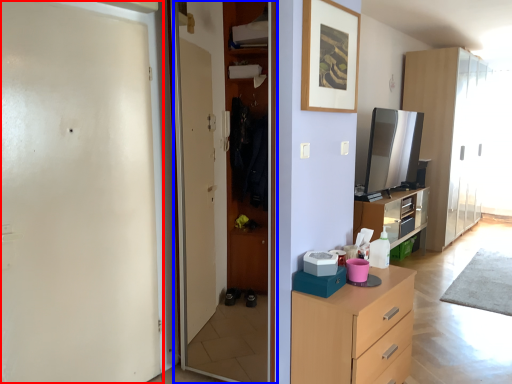
Question: Among these objects, which one is farthest to the camera, screen door (highlighted by a red box) or screen door (highlighted by a blue box)?

Choices:
 (A) screen door
 (B) screen door

Answer: (B)